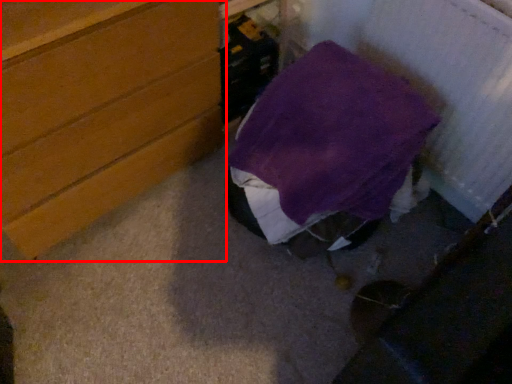
Question: From the image's perspective, where is chest of drawers (annotated by the red box) located relative to furniture?

Choices:
 (A) above
 (B) below

Answer: (A)